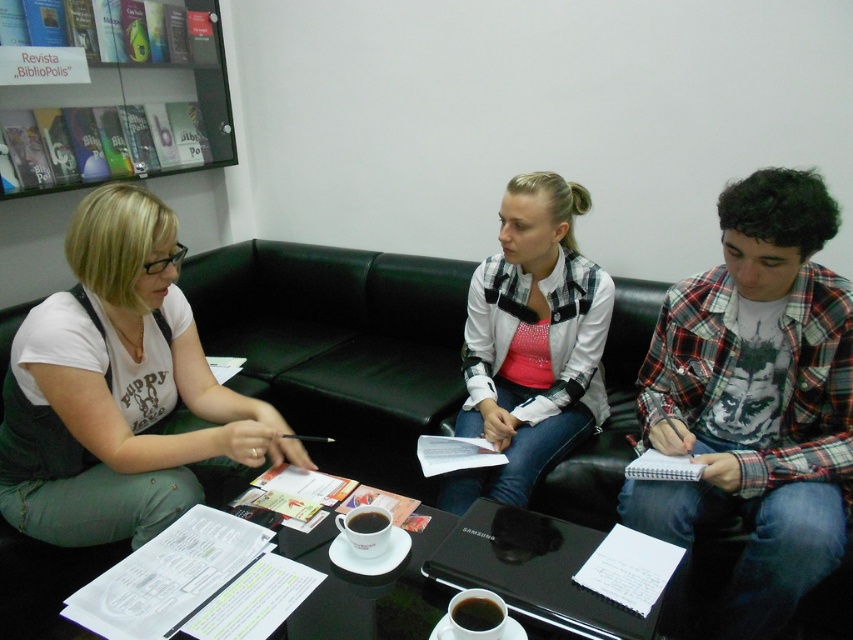
You are a person who is 5 feet tall. You want to reach the glassy plastic bookshelf at upper left from the dark brown ceramic cup at center. Can you stretch your hand upwards to reach it?

The glassy plastic bookshelf at upper left is 6.08 feet away from the dark brown ceramic cup at center. Since you are 5 feet tall, you might not be able to reach it without assistance.

You are a barista trying to deliver two cups to the people sitting on the couch. The cups are a dark brown ceramic cup at center and a black glossy cup at center. Which cup should you pick up first to avoid blocking the view of the other cup while serving?

You should pick up the black glossy cup at center first because it is behind the dark brown ceramic cup at center. By moving the back cup first, you can avoid blocking the view of the front cup during delivery.

You are a visitor entering the library and want to place your bag on the nearest available surface. You see the glassy plastic bookshelf at upper left and the dark brown ceramic cup at center. Which surface can you use to place your bag?

The glassy plastic bookshelf at upper left is further to the viewer than dark brown ceramic cup at center, so the dark brown ceramic cup at center is closer to you. However, the dark brown ceramic cup at center is likely occupied by the cup, so the glassy plastic bookshelf at upper left might be a better option if it has space. But since the question asks for the nearest available surface, you should check if the bookshelf is accessible. However, based on the description, the bookshelf is further away, so I